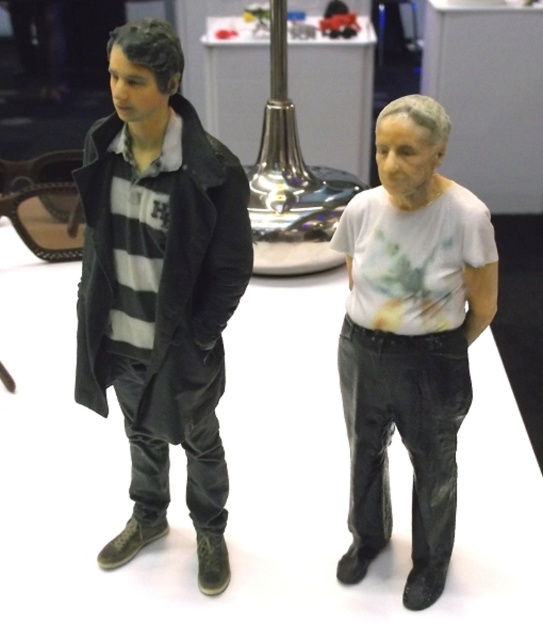
Does matte black coat at left have a lesser width compared to white matte t-shirt at center?

In fact, matte black coat at left might be wider than white matte t-shirt at center.

From the picture: Does matte black coat at left appear under white matte t-shirt at center?

Incorrect, matte black coat at left is not positioned below white matte t-shirt at center.

Locate an element on the screen. The image size is (543, 640). matte black coat at left is located at coordinates (160, 289).